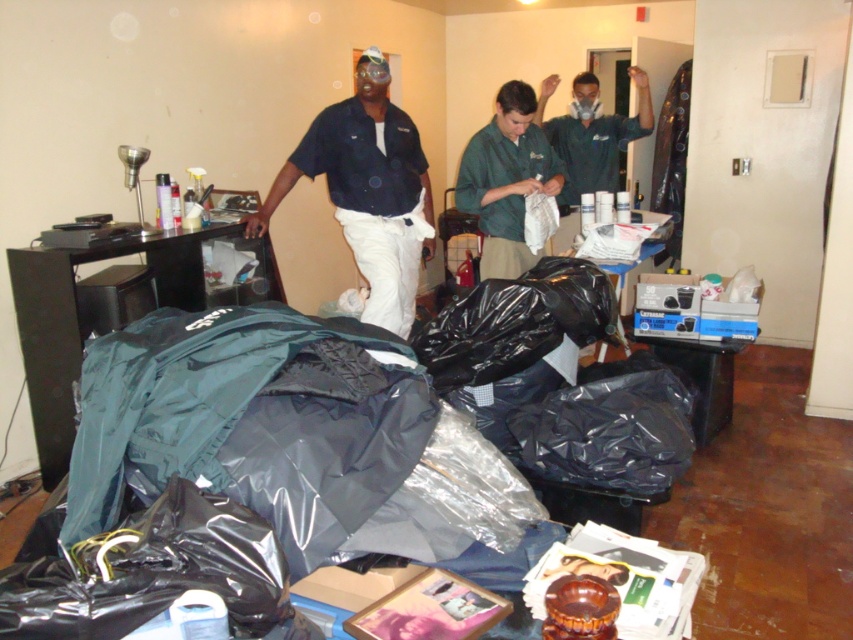
Which is more to the right, teal matte sleeping bag at lower left or matte black shirt at center?

matte black shirt at center is more to the right.

Is point (152, 385) positioned in front of point (416, 141)?

That is True.

I want to click on teal matte sleeping bag at lower left, so click(x=247, y=420).

Is black plastic bag at center closer to camera compared to teal matte sleeping bag at lower left?

Yes.

Does black plastic bag at center have a greater height compared to teal matte sleeping bag at lower left?

Indeed, black plastic bag at center has a greater height compared to teal matte sleeping bag at lower left.

Does point (227, 360) come behind point (286, 406)?

Yes.

Find the location of `black plastic bag at center`. black plastic bag at center is located at coordinates (299, 406).

Who is positioned more to the right, black plastic bag at center or green uniform at center?

green uniform at center is more to the right.

Between black plastic bag at center and green uniform at center, which one appears on the left side from the viewer's perspective?

black plastic bag at center is more to the left.

Where is `black plastic bag at center`? Image resolution: width=853 pixels, height=640 pixels. black plastic bag at center is located at coordinates (299, 406).